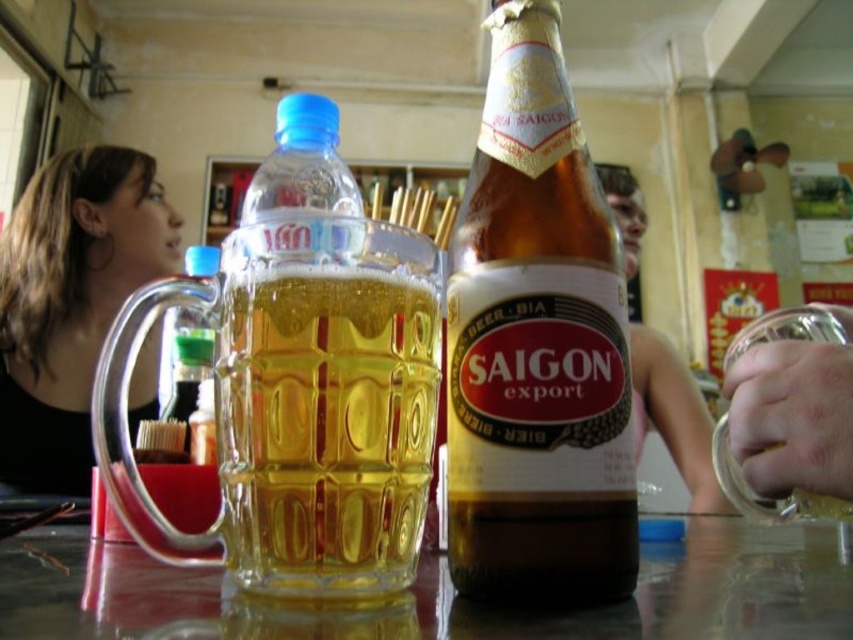
You are a waiter at a restaurant. You need to place a small coaster between the transparent glass table at center and the transparent glass beer glass at center. Is there enough space between them to fit the coaster?

The transparent glass table at center and transparent glass beer glass at center are 6.45 inches apart from each other. A standard coaster is approximately 4 inches in diameter, so there is sufficient space to place the coaster between them.

You are a customer at a bar and want to order a drink. The bartender points to a specific location on the table. The coordinates given are point (x=537, y=342). Which object is located at that point?

The brown glass bottle at center is located at point (x=537, y=342).

You are a bartender who needs to place both the brown glass bottle at center and the transparent glass beer glass at center on a shelf that can only hold items narrower than 10 cm. Can you fit both items on the shelf?

The brown glass bottle at center is narrower than the transparent glass beer glass at center. Since the shelf requires items narrower than 10 cm, we need to check both widths. If the beer glass is wider than the bottle but still under 10 cm, both fit. However, if the beer glass exceeds 10 cm, only the bottle fits. Without exact measurements, we can only say the bottle is narrower, but cannot confirm if both are under 10 cm.